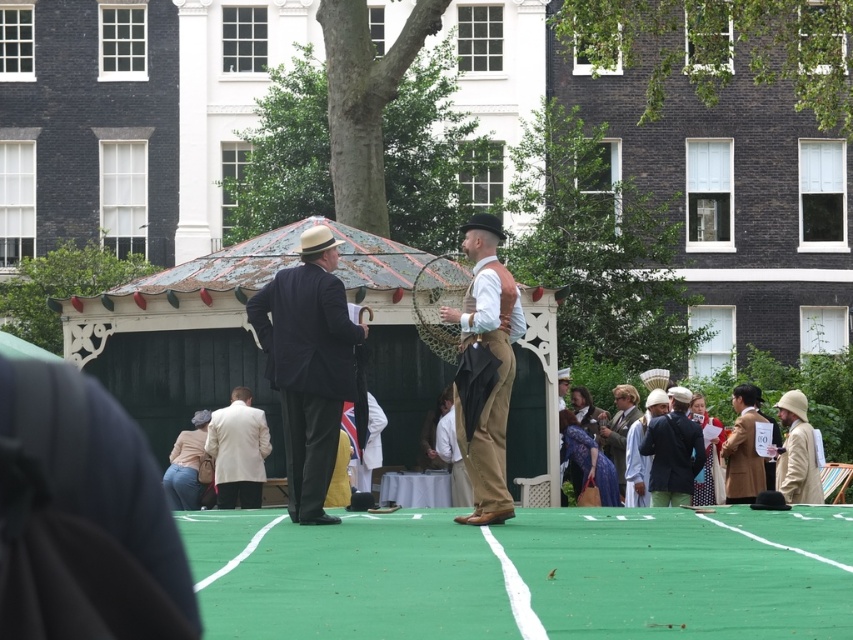
Who is positioned more to the right, dark blue suit at center or brown leather vest at center?

From the viewer's perspective, brown leather vest at center appears more on the right side.

Does dark blue suit at center have a greater width compared to brown leather vest at center?

Indeed, dark blue suit at center has a greater width compared to brown leather vest at center.

Identify the location of dark blue suit at center. (308, 365).

Where is `dark blue suit at center`? The width and height of the screenshot is (853, 640). dark blue suit at center is located at coordinates (308, 365).

Who is lower down, light beige fabric coat at center or light brown fabric hat at right?

light beige fabric coat at center is lower down.

Between point (233, 456) and point (720, 413), which one is positioned in front?

Point (233, 456)

What do you see at coordinates (238, 451) in the screenshot? The height and width of the screenshot is (640, 853). I see `light beige fabric coat at center` at bounding box center [238, 451].

Where is `light beige fabric coat at center`? This screenshot has height=640, width=853. light beige fabric coat at center is located at coordinates (238, 451).

Does brown leather vest at center lie in front of light brown fabric hat at right?

Yes, brown leather vest at center is in front of light brown fabric hat at right.

Which is below, brown leather vest at center or light brown fabric hat at right?

brown leather vest at center is lower down.

Measure the distance between brown leather vest at center and camera.

brown leather vest at center and camera are 34.17 meters apart from each other.

I want to click on brown leather vest at center, so click(485, 369).